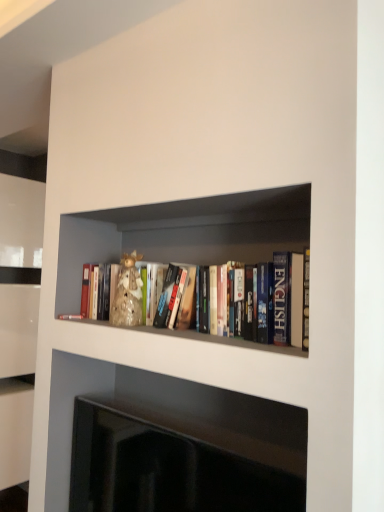
This screenshot has height=512, width=384. Describe the element at coordinates (187, 454) in the screenshot. I see `black glossy fireplace at lower center` at that location.

I want to click on black glossy fireplace at lower center, so click(x=187, y=454).

Describe the element at coordinates (258, 306) in the screenshot. The width and height of the screenshot is (384, 512). I see `hardcover books at center` at that location.

Identify the location of hardcover books at center. (258, 306).

I want to click on black glossy fireplace at lower center, so click(187, 454).

Considering the relative positions of hardcover books at center and black glossy fireplace at lower center in the image provided, is hardcover books at center to the left of black glossy fireplace at lower center from the viewer's perspective?

No, hardcover books at center is not to the left of black glossy fireplace at lower center.

Is hardcover books at center positioned before black glossy fireplace at lower center?

No, it is behind black glossy fireplace at lower center.

Is point (291, 298) less distant than point (137, 461)?

Yes, it is.

From the image's perspective, between hardcover books at center and black glossy fireplace at lower center, which one is located above?

hardcover books at center is shown above in the image.

From a real-world perspective, who is located lower, hardcover books at center or black glossy fireplace at lower center?

black glossy fireplace at lower center.

Considering the relative sizes of hardcover books at center and black glossy fireplace at lower center in the image provided, is hardcover books at center wider than black glossy fireplace at lower center?

Indeed, hardcover books at center has a greater width compared to black glossy fireplace at lower center.

Between hardcover books at center and black glossy fireplace at lower center, which one has less height?

hardcover books at center is shorter.

Between hardcover books at center and black glossy fireplace at lower center, which one has smaller size?

black glossy fireplace at lower center is smaller.

Is hardcover books at center completely or partially outside of black glossy fireplace at lower center?

Yes.

Is hardcover books at center not close to black glossy fireplace at lower center?

Actually, hardcover books at center and black glossy fireplace at lower center are a little close together.

Is hardcover books at center facing away from black glossy fireplace at lower center?

That's not correct — hardcover books at center is not looking away from black glossy fireplace at lower center.

How different are the orientations of hardcover books at center and black glossy fireplace at lower center in degrees?

They differ by 0.000195 degrees in their facing directions.

The height and width of the screenshot is (512, 384). In order to click on book located above the black glossy fireplace at lower center (from the image's perspective) in this screenshot , I will do point(258,306).

Considering the relative positions of black glossy fireplace at lower center and hardcover books at center in the image provided, is black glossy fireplace at lower center to the left or to the right of hardcover books at center?

In the image, black glossy fireplace at lower center appears on the left side of hardcover books at center.

Which object is closer to the camera, black glossy fireplace at lower center or hardcover books at center?

black glossy fireplace at lower center is more forward.

Is point (229, 480) positioned after point (284, 320)?

Yes, it is.

From the image's perspective, is black glossy fireplace at lower center above or below hardcover books at center?

Clearly, from the image's perspective, black glossy fireplace at lower center is below hardcover books at center.

From a real-world perspective, who is located higher, black glossy fireplace at lower center or hardcover books at center?

hardcover books at center is physically above.

Considering the sizes of black glossy fireplace at lower center and hardcover books at center in the image, is black glossy fireplace at lower center wider or thinner than hardcover books at center?

black glossy fireplace at lower center is thinner than hardcover books at center.

Who is shorter, black glossy fireplace at lower center or hardcover books at center?

With less height is hardcover books at center.

Looking at the image, does black glossy fireplace at lower center seem bigger or smaller compared to hardcover books at center?

black glossy fireplace at lower center is smaller than hardcover books at center.

Could hardcover books at center be considered to be inside black glossy fireplace at lower center?

Actually, hardcover books at center is outside black glossy fireplace at lower center.

Is there a large distance between black glossy fireplace at lower center and hardcover books at center?

No, black glossy fireplace at lower center is in close proximity to hardcover books at center.

Is black glossy fireplace at lower center turned away from hardcover books at center?

That's not correct — black glossy fireplace at lower center is not looking away from hardcover books at center.

Can you tell me how much black glossy fireplace at lower center and hardcover books at center differ in facing direction?

They differ by 0.000195 degrees in their facing directions.

The height and width of the screenshot is (512, 384). I want to click on fireplace located below the hardcover books at center (from the image's perspective), so click(187, 454).

At what (x,y) coordinates should I click in order to perform the action: click on book above the black glossy fireplace at lower center (from a real-world perspective). Please return your answer as a coordinate pair (x, y). Image resolution: width=384 pixels, height=512 pixels. Looking at the image, I should click on (258, 306).

Find the location of a particular element. The height and width of the screenshot is (512, 384). book behind the black glossy fireplace at lower center is located at coordinates (258, 306).